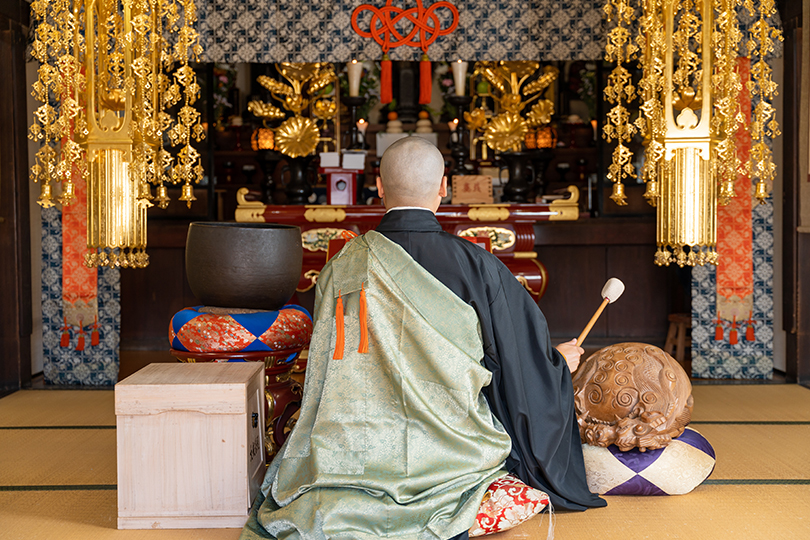
At what (x,y) coordinates should I click in order to perform the action: click on gold decorative hanging banners. Please return your answer as a coordinate pair (x, y). The height and width of the screenshot is (540, 810). Looking at the image, I should click on (120, 163), (710, 167).